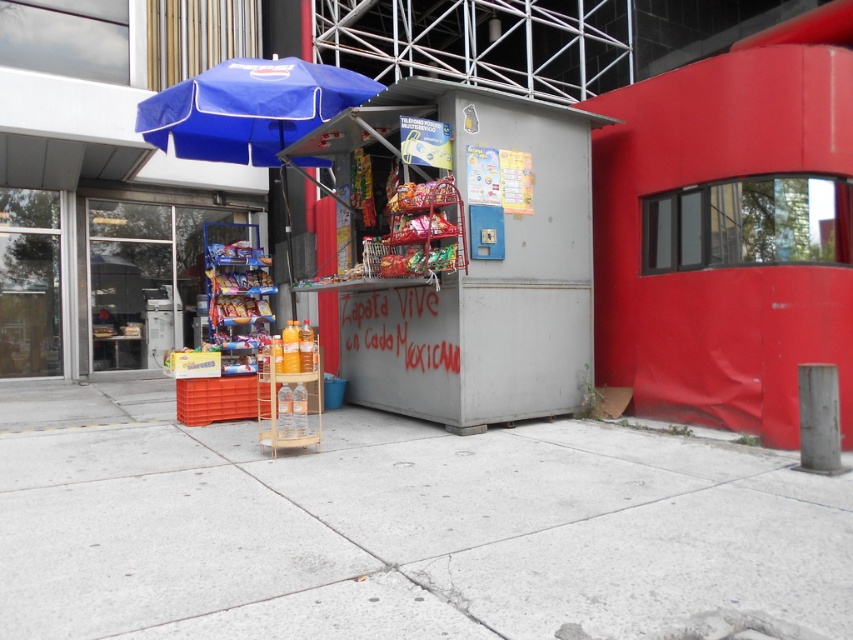
In the scene shown: You are standing in front of the kiosk and want to reach both the point at location (590, 355) and the point at (358, 97). Which point will you reach first?

You will reach point (590, 355) first because it is closer to you than point (358, 97).